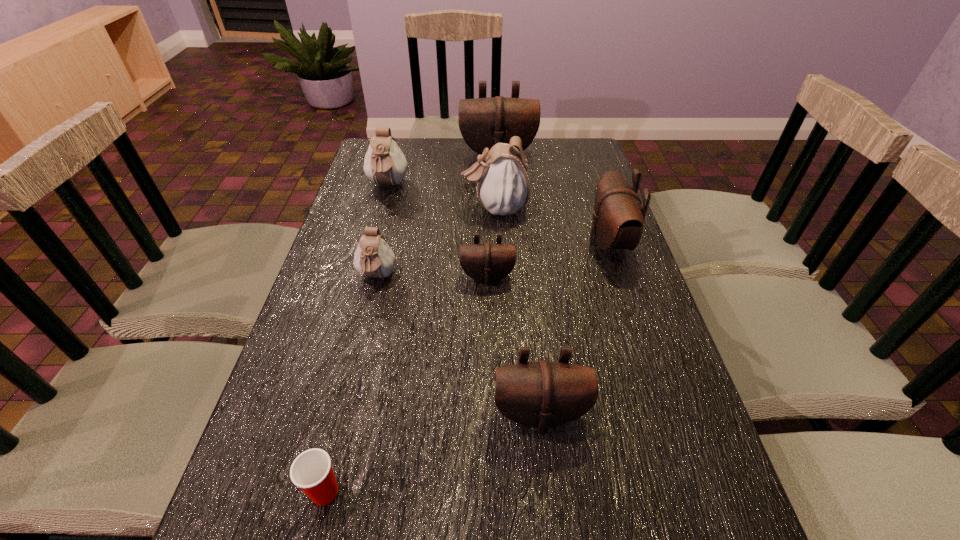
Image resolution: width=960 pixels, height=540 pixels. In order to click on red Dixie cup in this screenshot , I will do `click(311, 471)`.

The height and width of the screenshot is (540, 960). What are the coordinates of `the nearest object` in the screenshot? It's located at (311, 471).

The image size is (960, 540). Identify the location of free space located with the flap open on the farthest object. (499, 180).

I want to click on vacant position located 0.250m on the front-facing side of the biggest white pouch, so click(x=379, y=208).

I want to click on free point located on the front-facing side of the biggest white pouch, so click(359, 208).

I want to click on vacant area situated on the front-facing side of the biggest white pouch, so click(379, 208).

At what (x,y) coordinates should I click in order to perform the action: click on free space located 0.340m with the flap open on the rightmost object. Please return your answer as a coordinate pair (x, y). The width and height of the screenshot is (960, 540). Looking at the image, I should click on (465, 242).

I want to click on vacant area located 0.110m with the flap open on the rightmost object, so click(548, 242).

The height and width of the screenshot is (540, 960). In order to click on vacant space located 0.210m with the flap open on the rightmost object in this screenshot , I will do pos(512,242).

The width and height of the screenshot is (960, 540). Identify the location of blank space located 0.280m on the front-facing side of the second biggest white pouch. (367, 260).